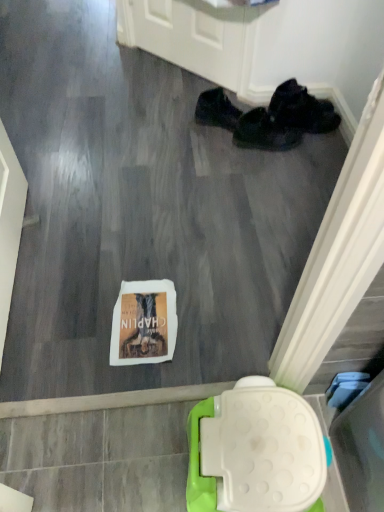
Question: Considering the relative sizes of black fabric shoe at upper right, the third footwear viewed from the right, and black fabric shoes at center, the second footwear positioned from the left, in the image provided, is black fabric shoe at upper right, the third footwear viewed from the right, wider than black fabric shoes at center, the second footwear positioned from the left,?

Choices:
 (A) yes
 (B) no

Answer: (A)

Question: Can you confirm if black fabric shoe at upper right, the third footwear viewed from the right, is thinner than black fabric shoes at center, the second footwear positioned from the left?

Choices:
 (A) yes
 (B) no

Answer: (B)

Question: Can you confirm if black fabric shoe at upper right, the third footwear viewed from the right, is taller than black fabric shoes at center, the second footwear positioned from the left?

Choices:
 (A) yes
 (B) no

Answer: (A)

Question: Is black fabric shoe at upper right, which appears as the first footwear when viewed from the left, looking in the opposite direction of black fabric shoes at center, positioned as the 2th footwear in right-to-left order?

Choices:
 (A) yes
 (B) no

Answer: (B)

Question: From the image's perspective, would you say black fabric shoe at upper right, which appears as the first footwear when viewed from the left, is shown under black fabric shoes at center, the second footwear positioned from the left?

Choices:
 (A) yes
 (B) no

Answer: (B)

Question: Can you confirm if black fabric shoe at upper right, which appears as the first footwear when viewed from the left, is positioned to the left of black fabric shoes at center, positioned as the 2th footwear in right-to-left order?

Choices:
 (A) no
 (B) yes

Answer: (B)

Question: Does black fabric shoes at upper right, the 1th footwear when ordered from right to left, have a smaller size compared to black fabric shoes at center, the second footwear positioned from the left?

Choices:
 (A) no
 (B) yes

Answer: (A)

Question: Can you confirm if black fabric shoes at upper right, which is the 3th footwear in left-to-right order, is wider than black fabric shoes at center, the second footwear positioned from the left?

Choices:
 (A) no
 (B) yes

Answer: (B)

Question: Does black fabric shoes at upper right, which is the 3th footwear in left-to-right order, lie in front of black fabric shoes at center, the second footwear positioned from the left?

Choices:
 (A) yes
 (B) no

Answer: (B)

Question: From the image's perspective, is black fabric shoes at upper right, the 1th footwear when ordered from right to left, on black fabric shoes at center, positioned as the 2th footwear in right-to-left order?

Choices:
 (A) yes
 (B) no

Answer: (A)

Question: From a real-world perspective, is black fabric shoes at upper right, which is the 3th footwear in left-to-right order, under black fabric shoes at center, the second footwear positioned from the left?

Choices:
 (A) yes
 (B) no

Answer: (B)

Question: Considering the relative sizes of black fabric shoes at upper right, the 1th footwear when ordered from right to left, and black fabric shoes at center, the second footwear positioned from the left, in the image provided, is black fabric shoes at upper right, the 1th footwear when ordered from right to left, thinner than black fabric shoes at center, the second footwear positioned from the left,?

Choices:
 (A) yes
 (B) no

Answer: (B)

Question: Can black fabric shoes at upper right, the 1th footwear when ordered from right to left, be found inside black fabric shoe at upper right, the third footwear viewed from the right?

Choices:
 (A) no
 (B) yes

Answer: (A)